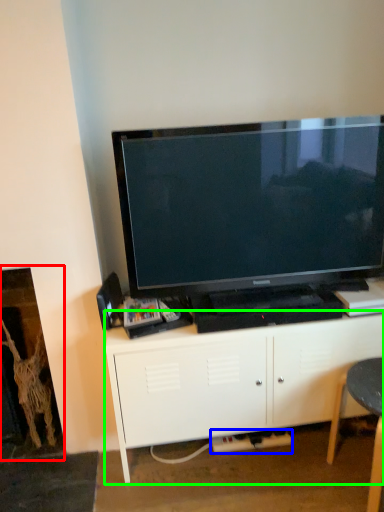
Question: Estimate the real-world distances between objects in this image. Which object is closer to fireplace (highlighted by a red box), plug (highlighted by a blue box) or cabinetry (highlighted by a green box)?

Choices:
 (A) plug
 (B) cabinetry

Answer: (B)